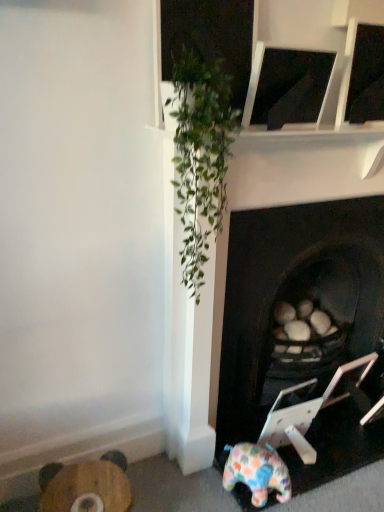
Question: Should I look upward or downward to see multicolored plush elephant at lower right?

Choices:
 (A) down
 (B) up

Answer: (A)

Question: Can you confirm if wooden stool at lower left is shorter than multicolored plush elephant at lower right?

Choices:
 (A) no
 (B) yes

Answer: (A)

Question: From the image's perspective, is wooden stool at lower left on top of multicolored plush elephant at lower right?

Choices:
 (A) yes
 (B) no

Answer: (B)

Question: Is there a large distance between wooden stool at lower left and multicolored plush elephant at lower right?

Choices:
 (A) yes
 (B) no

Answer: (B)

Question: Is multicolored plush elephant at lower right a part of wooden stool at lower left?

Choices:
 (A) no
 (B) yes

Answer: (A)

Question: Does wooden stool at lower left have a greater width compared to multicolored plush elephant at lower right?

Choices:
 (A) yes
 (B) no

Answer: (B)

Question: From a real-world perspective, is wooden stool at lower left on top of multicolored plush elephant at lower right?

Choices:
 (A) no
 (B) yes

Answer: (A)

Question: Considering the relative sizes of dark wood fireplace at center and wooden stool at lower left in the image provided, is dark wood fireplace at center shorter than wooden stool at lower left?

Choices:
 (A) no
 (B) yes

Answer: (A)

Question: From the image's perspective, is dark wood fireplace at center located above wooden stool at lower left?

Choices:
 (A) yes
 (B) no

Answer: (A)

Question: Is dark wood fireplace at center aimed at wooden stool at lower left?

Choices:
 (A) no
 (B) yes

Answer: (A)

Question: Considering the relative sizes of dark wood fireplace at center and wooden stool at lower left in the image provided, is dark wood fireplace at center taller than wooden stool at lower left?

Choices:
 (A) yes
 (B) no

Answer: (A)

Question: Is dark wood fireplace at center not inside wooden stool at lower left?

Choices:
 (A) yes
 (B) no

Answer: (A)

Question: Is dark wood fireplace at center positioned far away from wooden stool at lower left?

Choices:
 (A) no
 (B) yes

Answer: (A)

Question: Considering the relative sizes of wooden stool at lower left and dark wood fireplace at center in the image provided, is wooden stool at lower left taller than dark wood fireplace at center?

Choices:
 (A) yes
 (B) no

Answer: (B)